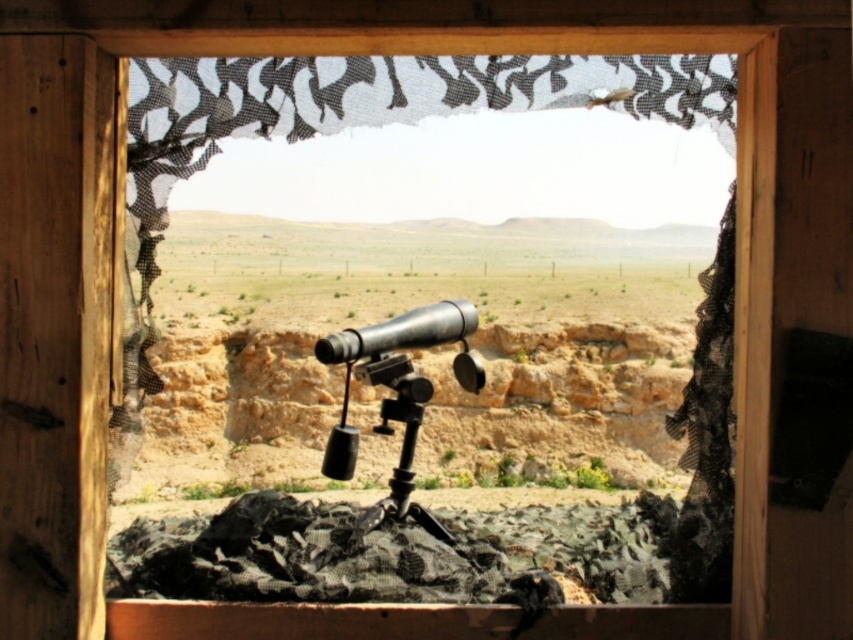
Can you confirm if black mesh curtain at right is positioned above brushed metal telescope at center?

No, black mesh curtain at right is not above brushed metal telescope at center.

Describe the element at coordinates (706, 436) in the screenshot. I see `black mesh curtain at right` at that location.

The height and width of the screenshot is (640, 853). In order to click on black mesh curtain at right in this screenshot , I will do tap(706, 436).